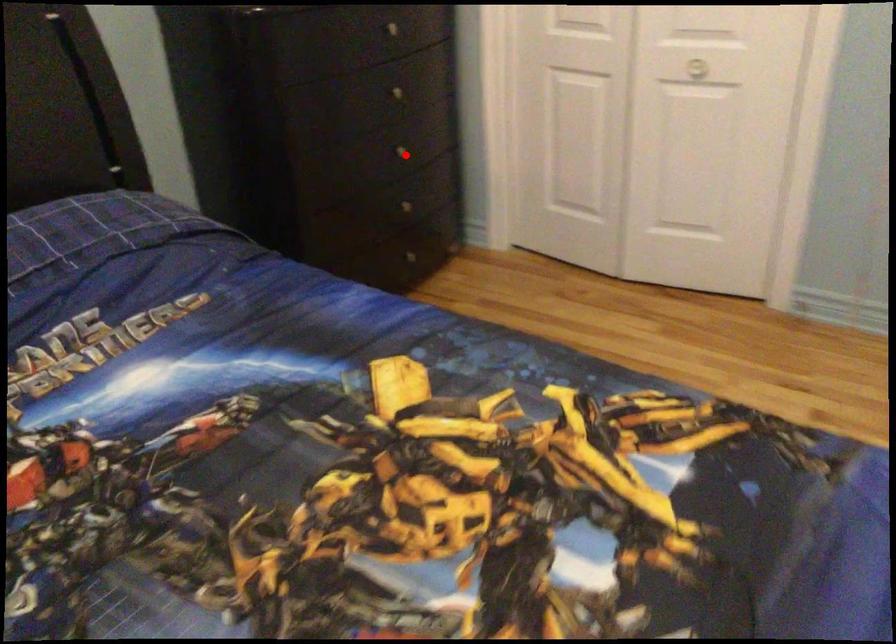
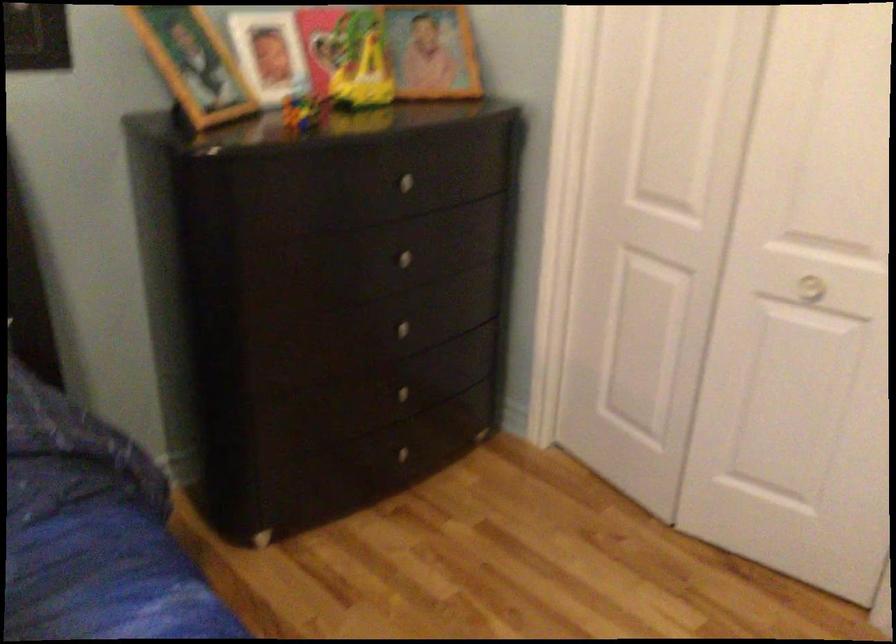
Find the pixel in the second image that matches the highlighted location in the first image.

(409, 332)